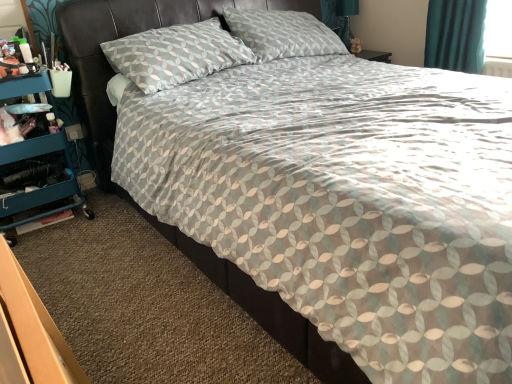
The height and width of the screenshot is (384, 512). What do you see at coordinates (455, 35) in the screenshot?
I see `teal fabric curtain at upper right` at bounding box center [455, 35].

Measure the distance between point (x=434, y=41) and camera.

8.92 feet.

The height and width of the screenshot is (384, 512). In order to click on teal fabric curtain at upper right in this screenshot , I will do `click(455, 35)`.

Identify the location of teal plastic cart at left. (37, 163).

Measure the distance between point (9, 199) and camera.

The distance of point (9, 199) from camera is 2.07 meters.

This screenshot has width=512, height=384. What do you see at coordinates (37, 163) in the screenshot? I see `teal plastic cart at left` at bounding box center [37, 163].

Identify the location of teal fabric curtain at upper right. (455, 35).

In the image, is teal fabric curtain at upper right on the left side or the right side of teal plastic cart at left?

Based on their positions, teal fabric curtain at upper right is located to the right of teal plastic cart at left.

Is teal fabric curtain at upper right positioned before teal plastic cart at left?

That is False.

Considering the positions of point (439, 29) and point (50, 156), is point (439, 29) closer or farther from the camera than point (50, 156)?

Point (439, 29) is positioned farther from the camera compared to point (50, 156).

From the image's perspective, is teal fabric curtain at upper right located above teal plastic cart at left?

Yes, from the image's perspective, teal fabric curtain at upper right is on top of teal plastic cart at left.

From a real-world perspective, is teal fabric curtain at upper right under teal plastic cart at left?

No, from a real-world perspective, teal fabric curtain at upper right is not below teal plastic cart at left.

Which object is thinner, teal fabric curtain at upper right or teal plastic cart at left?

Thinner between the two is teal fabric curtain at upper right.

Between teal fabric curtain at upper right and teal plastic cart at left, which one has more height?

With more height is teal plastic cart at left.

Considering the sizes of objects teal fabric curtain at upper right and teal plastic cart at left in the image provided, who is smaller, teal fabric curtain at upper right or teal plastic cart at left?

teal fabric curtain at upper right is smaller.

Is teal fabric curtain at upper right located outside teal plastic cart at left?

Yes.

Is teal fabric curtain at upper right far away from teal plastic cart at left?

Yes, teal fabric curtain at upper right and teal plastic cart at left are located far from each other.

Is teal fabric curtain at upper right oriented towards teal plastic cart at left?

Yes, teal fabric curtain at upper right is facing teal plastic cart at left.

How different are the orientations of teal fabric curtain at upper right and teal plastic cart at left in degrees?

The angle between the facing direction of teal fabric curtain at upper right and the facing direction of teal plastic cart at left is 91 degrees.

How distant is teal fabric curtain at upper right from teal plastic cart at left?

They are 2.40 meters apart.

You are a GUI agent. You are given a task and a screenshot of the screen. Output one action in this format:
    pyautogui.click(x=<x>, y=<y>)
    Task: Click on the curtain behind the teal plastic cart at left
    
    Given the screenshot: What is the action you would take?
    pyautogui.click(x=455, y=35)

Can you confirm if teal plastic cart at left is positioned to the right of teal fabric curtain at upper right?

Incorrect, teal plastic cart at left is not on the right side of teal fabric curtain at upper right.

Is teal plastic cart at left further to the viewer compared to teal fabric curtain at upper right?

That is False.

Is point (5, 86) less distant than point (425, 44)?

Yes, it is.

From the image's perspective, is teal plastic cart at left located above teal fabric curtain at upper right?

Incorrect, from the image's perspective, teal plastic cart at left is lower than teal fabric curtain at upper right.

From a real-world perspective, between teal plastic cart at left and teal fabric curtain at upper right, who is vertically lower?

From a 3D spatial view, teal plastic cart at left is below.

Which object is thinner, teal plastic cart at left or teal fabric curtain at upper right?

Thinner between the two is teal fabric curtain at upper right.

Does teal plastic cart at left have a greater height compared to teal fabric curtain at upper right?

Yes, teal plastic cart at left is taller than teal fabric curtain at upper right.

In terms of size, does teal plastic cart at left appear bigger or smaller than teal fabric curtain at upper right?

Answer: Clearly, teal plastic cart at left is larger in size than teal fabric curtain at upper right.

Is teal plastic cart at left inside or outside of teal fabric curtain at upper right?

teal plastic cart at left is not enclosed by teal fabric curtain at upper right.

In the scene shown: Is teal plastic cart at left in contact with teal fabric curtain at upper right?

No, teal plastic cart at left is not making contact with teal fabric curtain at upper right.

Is teal fabric curtain at upper right at the back of teal plastic cart at left?

No.

How much distance is there between teal plastic cart at left and teal fabric curtain at upper right?

teal plastic cart at left is 7.88 feet away from teal fabric curtain at upper right.

Locate an element on the screen. The image size is (512, 384). curtain behind the teal plastic cart at left is located at coordinates (455, 35).

I want to click on dresser below the teal fabric curtain at upper right (from a real-world perspective), so tap(37, 163).

At what (x,y) coordinates should I click in order to perform the action: click on dresser on the left of the teal fabric curtain at upper right. Please return your answer as a coordinate pair (x, y). This screenshot has width=512, height=384. Looking at the image, I should click on (37, 163).